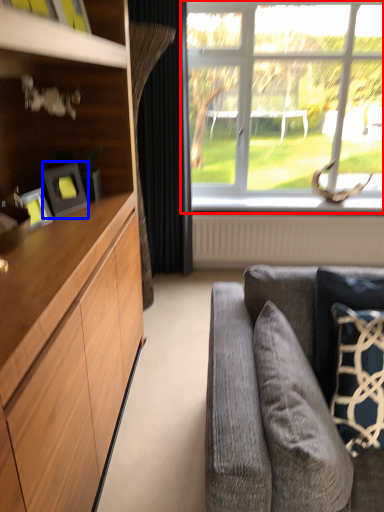
Question: Which of the following is the farthest to the observer, window (highlighted by a red box) or picture frame (highlighted by a blue box)?

Choices:
 (A) window
 (B) picture frame

Answer: (A)